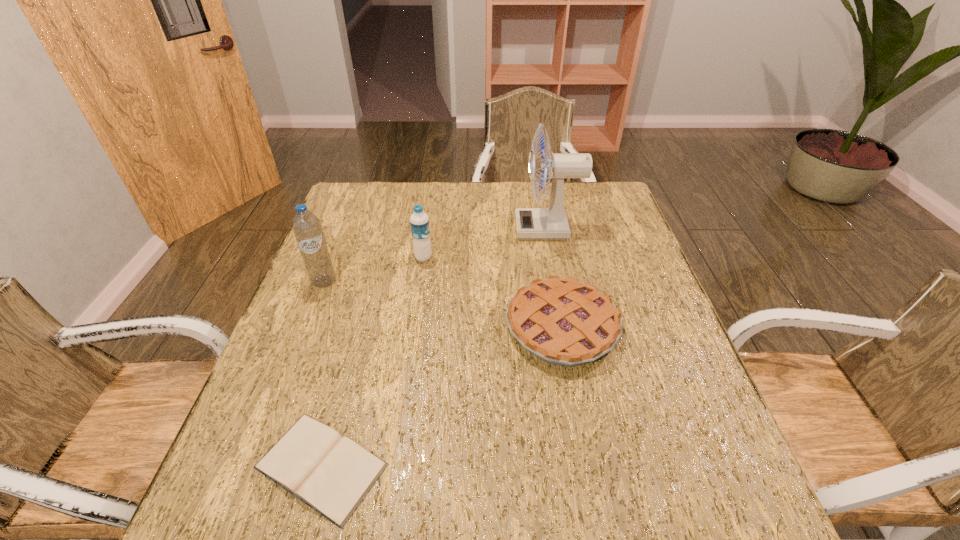
Locate an element on the screen. The width and height of the screenshot is (960, 540). free space between the pie and the taller water bottle is located at coordinates (443, 305).

The height and width of the screenshot is (540, 960). Find the location of `empty space between the tallest object and the fourth nearest object`. empty space between the tallest object and the fourth nearest object is located at coordinates (485, 243).

Identify the location of free space between the shorter water bottle and the pie. This screenshot has height=540, width=960. (492, 293).

Locate an element on the screen. This screenshot has height=540, width=960. free space between the fan and the nearest object is located at coordinates (434, 347).

The height and width of the screenshot is (540, 960). I want to click on vacant space that's between the tallest object and the nearer water bottle, so click(436, 255).

Find the location of a particular element. vacant region between the shorter water bottle and the second shortest object is located at coordinates (492, 293).

The image size is (960, 540). What are the coordinates of `vacant space that is in between the fan and the taller water bottle` in the screenshot? It's located at (436, 255).

The height and width of the screenshot is (540, 960). Find the location of `object that stands as the third closest to the nearest object`. object that stands as the third closest to the nearest object is located at coordinates (419, 221).

Select which object is the third closest to the fourth nearest object. Please provide its 2D coordinates. Your answer should be formatted as a tuple, i.e. [(x, y)], where the tuple contains the x and y coordinates of a point satisfying the conditions above.

[(531, 223)]

This screenshot has height=540, width=960. Find the location of `vacant area that satisfies the following two spatial constraints: 1. on the label of the second shortest object; 2. on the right side of the second farthest object`. vacant area that satisfies the following two spatial constraints: 1. on the label of the second shortest object; 2. on the right side of the second farthest object is located at coordinates (413, 328).